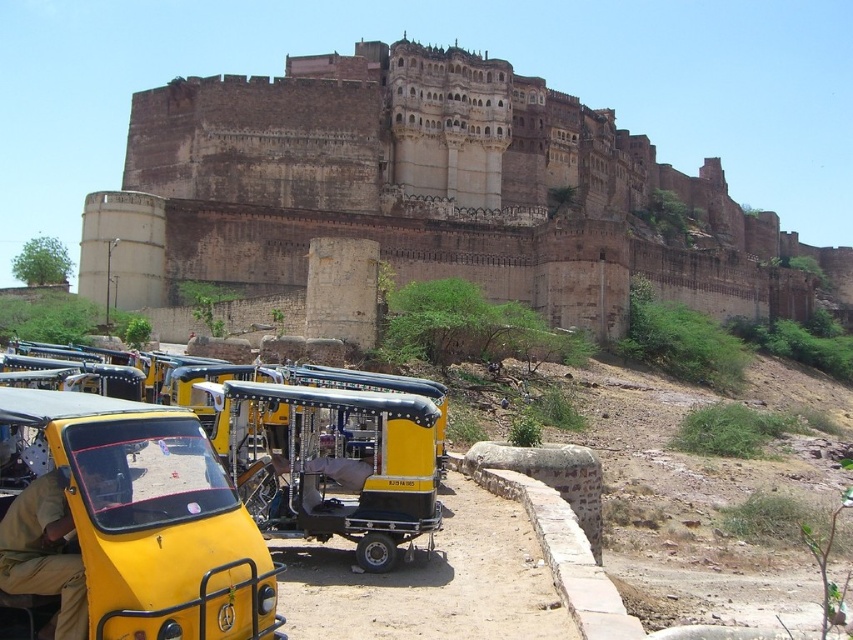
Question: Can you confirm if khaki fabric shirt at lower left is positioned above yellow fabric-covered cart at center?

Choices:
 (A) no
 (B) yes

Answer: (A)

Question: Among these points, which one is nearest to the camera?

Choices:
 (A) (22, 522)
 (B) (161, 552)
 (C) (112, 232)
 (D) (314, 493)

Answer: (B)

Question: Does yellow matte auto-rickshaw at lower left have a smaller size compared to khaki fabric shirt at lower left?

Choices:
 (A) yes
 (B) no

Answer: (B)

Question: Which point is farther to the camera?

Choices:
 (A) yellow fabric-covered cart at center
 (B) brown stone castle at upper center

Answer: (B)

Question: Which of the following is the closest to the observer?

Choices:
 (A) (0, 609)
 (B) (277, 458)
 (C) (77, 593)
 (D) (259, 173)

Answer: (C)

Question: Where is brown stone castle at upper center located in relation to yellow matte auto-rickshaw at lower left in the image?

Choices:
 (A) above
 (B) below

Answer: (A)